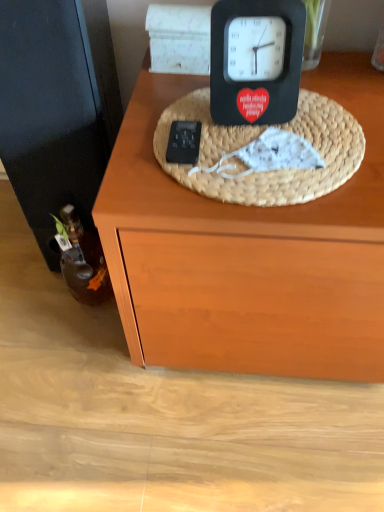
Locate an element on the screen. vacant space situated on the left part of brown glass bottle at left is located at coordinates (32, 298).